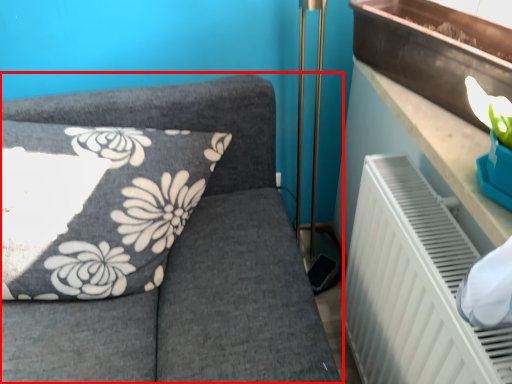
Question: In this image, where is furniture (annotated by the red box) located relative to window sill?

Choices:
 (A) right
 (B) left

Answer: (B)